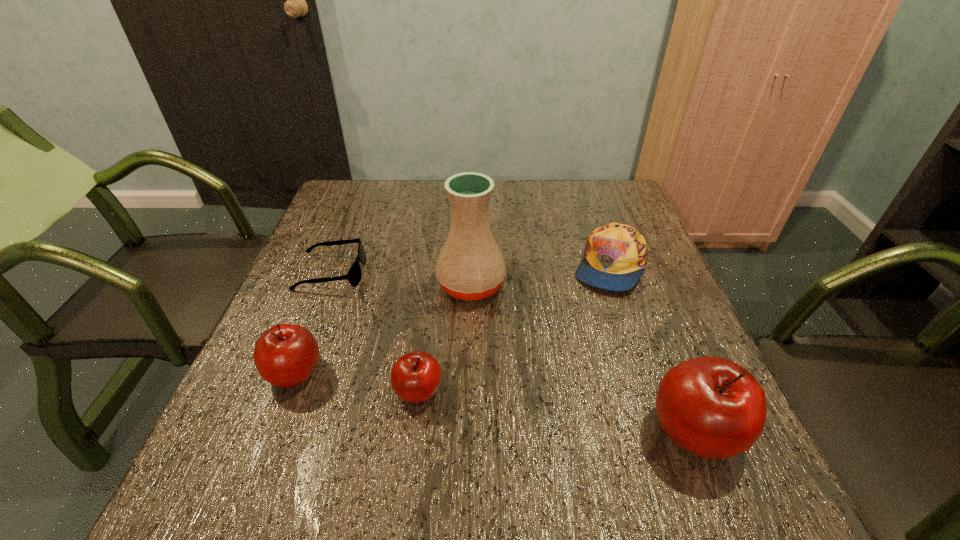
Locate an element on the screen. The width and height of the screenshot is (960, 540). the leftmost apple is located at coordinates (285, 355).

This screenshot has width=960, height=540. In order to click on the third tallest object in this screenshot , I will do `click(285, 355)`.

Find the location of a particular element. Image resolution: width=960 pixels, height=540 pixels. the shortest apple is located at coordinates (415, 377).

Where is `the rightmost apple`? Image resolution: width=960 pixels, height=540 pixels. the rightmost apple is located at coordinates (712, 407).

Where is `the tallest apple`? The image size is (960, 540). the tallest apple is located at coordinates (712, 407).

The height and width of the screenshot is (540, 960). Identify the location of the tallest object. (470, 266).

Identify the location of the shortest object. (354, 275).

Locate an element on the screen. cap is located at coordinates (616, 255).

Locate an element on the screen. Image resolution: width=960 pixels, height=540 pixels. free space located 0.140m on the back of the fourth shortest object is located at coordinates (323, 302).

Where is `vacant space located 0.380m on the right of the shortest apple`? Image resolution: width=960 pixels, height=540 pixels. vacant space located 0.380m on the right of the shortest apple is located at coordinates (647, 391).